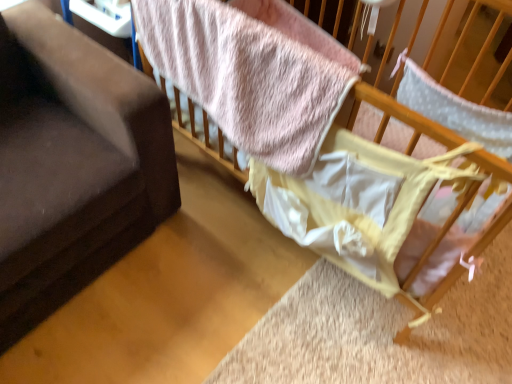
This screenshot has width=512, height=384. I want to click on vacant space underneath pink fuzzy blanket at upper center (from a real-world perspective), so click(x=224, y=221).